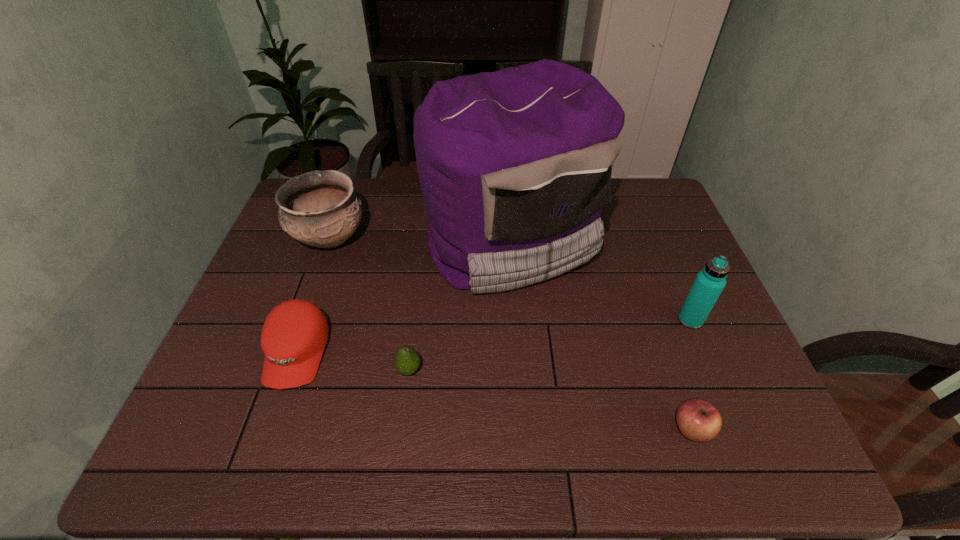
Locate an element on the screen. vacant point located between the avocado and the backpack is located at coordinates (460, 306).

Where is `vacant area that lies between the tallest object and the rightmost object`? The height and width of the screenshot is (540, 960). vacant area that lies between the tallest object and the rightmost object is located at coordinates (601, 281).

This screenshot has width=960, height=540. Find the location of `empty space that is in between the apple and the water bottle`. empty space that is in between the apple and the water bottle is located at coordinates (691, 375).

The image size is (960, 540). I want to click on free space between the fifth object from left to right and the second tallest object, so tap(691, 375).

Locate an element on the screen. This screenshot has height=540, width=960. vacant space in between the avocado and the cap is located at coordinates (353, 361).

Identify which object is the third closest to the third tallest object. Please provide its 2D coordinates. Your answer should be formatted as a tuple, i.e. [(x, y)], where the tuple contains the x and y coordinates of a point satisfying the conditions above.

[(406, 361)]

Locate which object ranks fifth in proximity to the fifth object from left to right. Please provide its 2D coordinates. Your answer should be formatted as a tuple, i.e. [(x, y)], where the tuple contains the x and y coordinates of a point satisfying the conditions above.

[(319, 208)]

This screenshot has width=960, height=540. I want to click on vacant area that satisfies the following two spatial constraints: 1. on the front-facing side of the cap; 2. on the left side of the second object from right to left, so click(x=271, y=430).

Image resolution: width=960 pixels, height=540 pixels. Identify the location of vacant space that satisfies the following two spatial constraints: 1. on the front pocket of the tallest object; 2. on the left side of the water bottle. (516, 320).

Identify the location of free spot that satisfies the following two spatial constraints: 1. on the front-facing side of the avocado; 2. on the left side of the cap. The height and width of the screenshot is (540, 960). (292, 370).